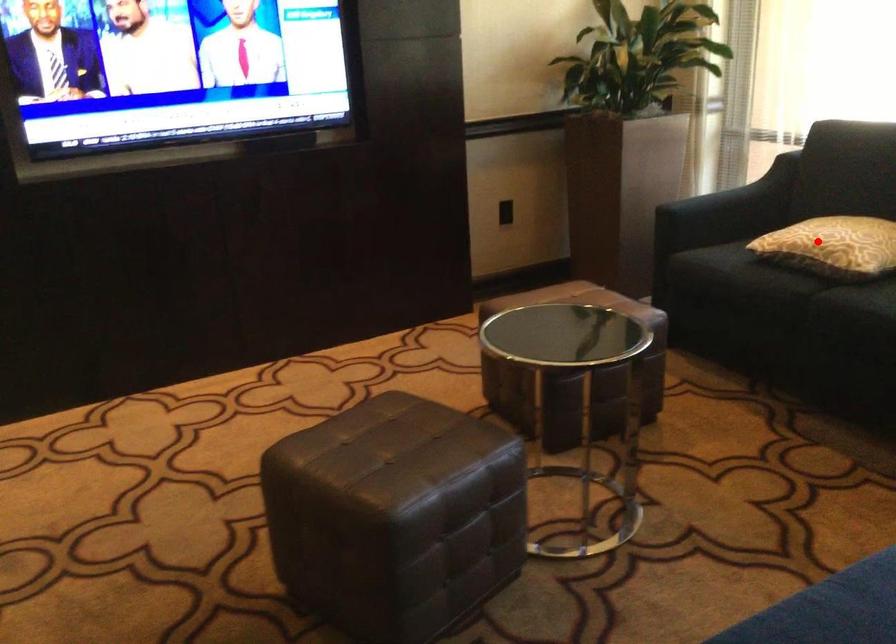
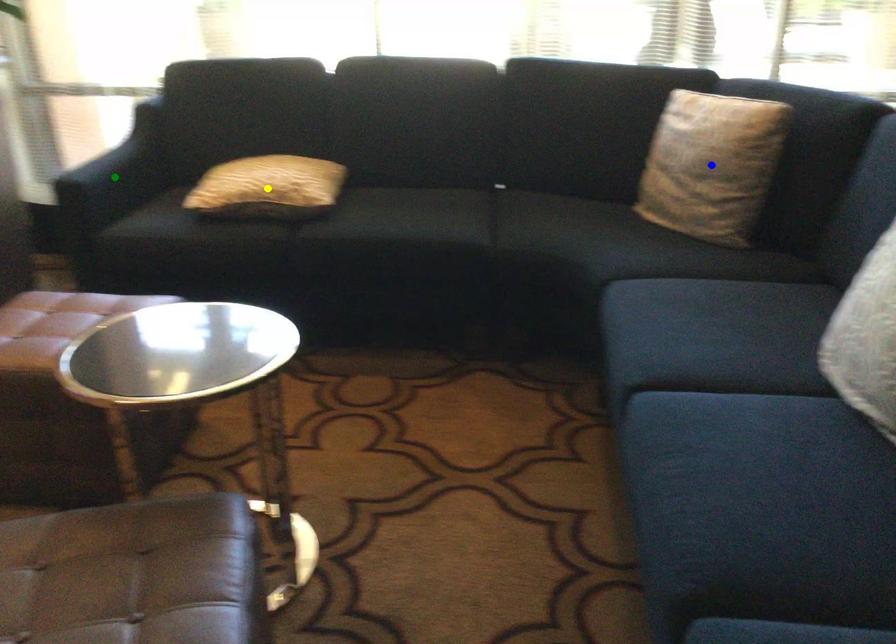
Question: I am providing you with two images of the same scene from different viewpoints. A red point is marked on the first image. You are given multiple points on the second image. Which point in image 2 represents the same 3d spot as the red point in image 1?

Choices:
 (A) green point
 (B) blue point
 (C) yellow point

Answer: (C)